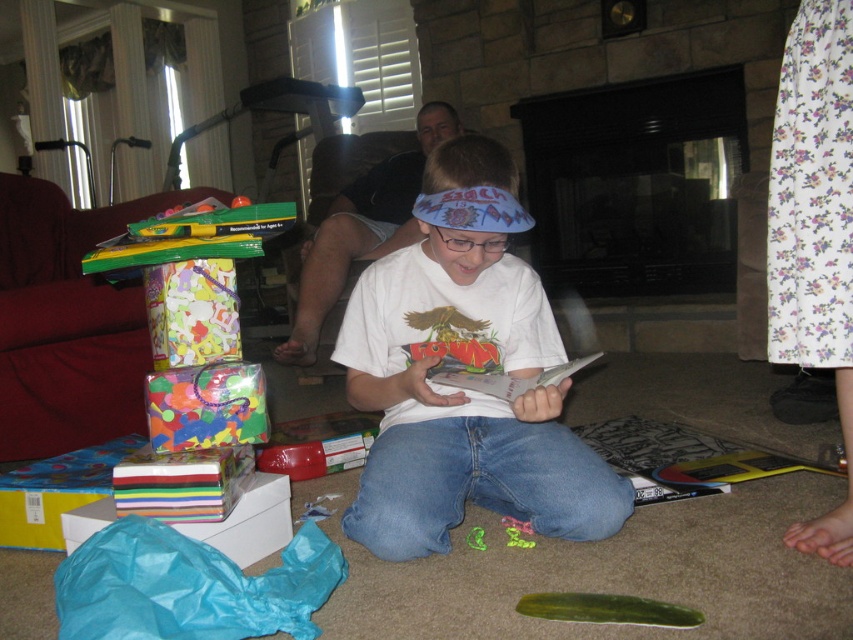
Between white t-shirt at center and white paper book at center, which one has less height?

With less height is white paper book at center.

Is white t-shirt at center further to camera compared to white paper book at center?

Yes, white t-shirt at center is further from the viewer.

Between point (508, 264) and point (601, 355), which one is positioned in front?

Point (508, 264) is in front.

Locate an element on the screen. The height and width of the screenshot is (640, 853). white t-shirt at center is located at coordinates (465, 369).

Can you confirm if green smooth pickle at lower center is taller than white paper book at center?

Incorrect, green smooth pickle at lower center's height is not larger of white paper book at center's.

Is green smooth pickle at lower center positioned before white paper book at center?

Yes, it is in front of white paper book at center.

Does point (566, 609) lie in front of point (519, 394)?

Yes, point (566, 609) is in front of point (519, 394).

You are a GUI agent. You are given a task and a screenshot of the screen. Output one action in this format:
    pyautogui.click(x=<x>, y=<y>)
    Task: Click on the green smooth pickle at lower center
    The image size is (853, 640).
    Given the screenshot: What is the action you would take?
    pyautogui.click(x=607, y=609)

Does white t-shirt at center lie behind green smooth pickle at lower center?

Yes, it is.

Does white t-shirt at center appear under green smooth pickle at lower center?

No.

The width and height of the screenshot is (853, 640). What are the coordinates of `white t-shirt at center` in the screenshot? It's located at (465, 369).